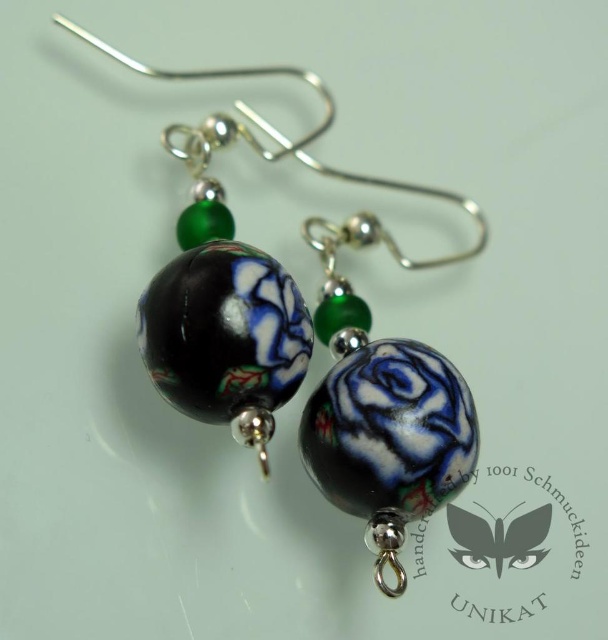
You are a jeweler who needs to place the matte black glass rose at center into a display case that is 4 feet away from the current position. Can you safely move it without needing to adjust the display case distance?

The matte black glass rose at center is currently 3.88 feet away from the viewer, which is within the 4 feet requirement. Therefore, you can safely move it without needing to adjust the display case distance.

You are a florist arranging a bouquet and have two roses in front of you. One is a matte black ceramic rose at center and the other is a matte black glass rose at center. Which rose should you choose if you want the taller one for the bouquet?

You should choose the matte black ceramic rose at center because it is much taller than the matte black glass rose at center.

You are an earring designer who wants to ensure that the matte black glass rose at center is the focal point of the design. Based on the provided image, does its size compared to the black glossy swirl at center help achieve this?

The matte black glass rose at center has a larger width than the black glossy swirl at center, which helps it stand out as the focal point of the design.